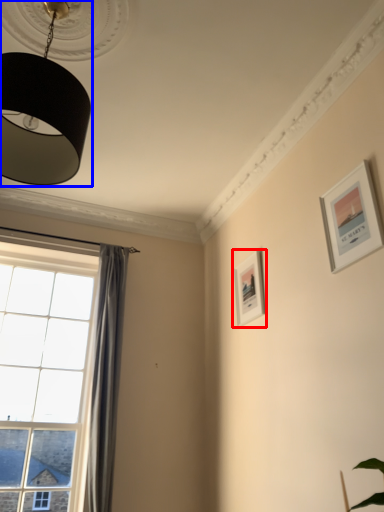
Question: Which object is closer to the camera taking this photo, picture frame (highlighted by a red box) or lamp (highlighted by a blue box)?

Choices:
 (A) picture frame
 (B) lamp

Answer: (B)